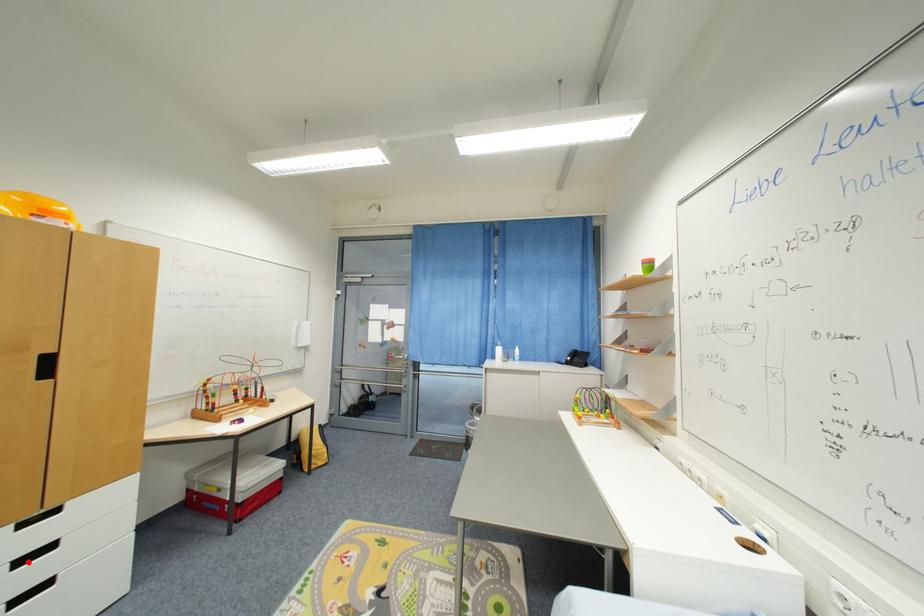
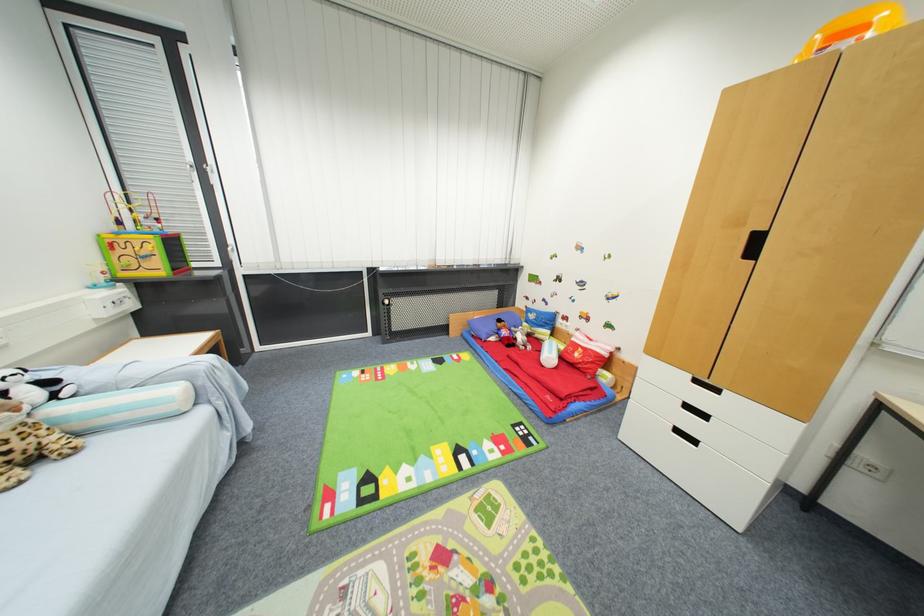
The point at the highlighted location is marked in the first image. Where is the corresponding point in the second image?

(691, 408)